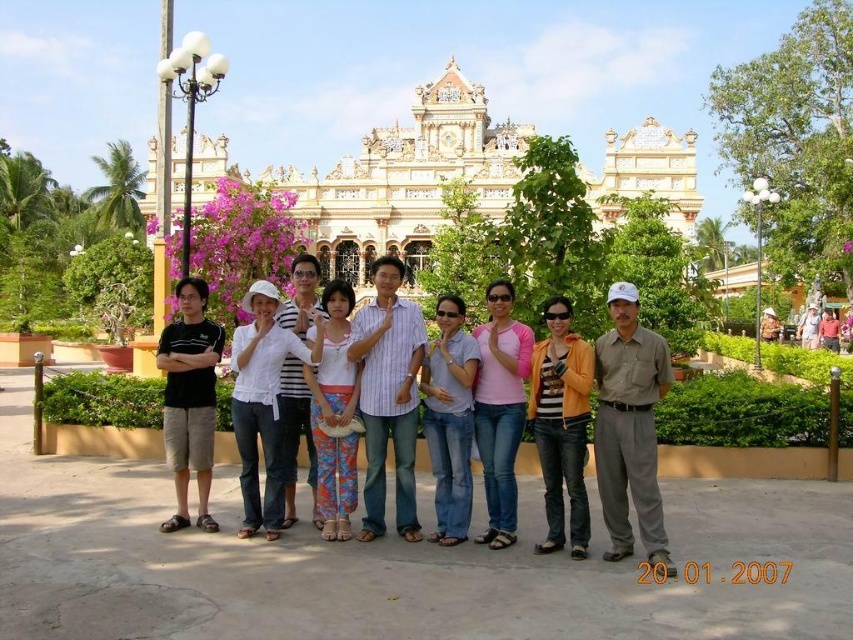
Does orange denim jacket at center have a greater width compared to pink cotton shirt at center?

Correct, the width of orange denim jacket at center exceeds that of pink cotton shirt at center.

Locate an element on the screen. orange denim jacket at center is located at coordinates (561, 424).

Which is in front, point (548, 330) or point (509, 422)?

Point (509, 422)

Locate an element on the screen. orange denim jacket at center is located at coordinates (x=561, y=424).

Who is lower down, striped cotton shirt at center or white cotton shirt at center?

Positioned lower is white cotton shirt at center.

Which is more to the left, striped cotton shirt at center or white cotton shirt at center?

white cotton shirt at center is more to the left.

Is point (389, 291) farther from viewer compared to point (248, 477)?

Yes, it is behind point (248, 477).

Where is `striped cotton shirt at center`? The height and width of the screenshot is (640, 853). striped cotton shirt at center is located at coordinates (387, 396).

Can you confirm if brown cotton shirt at center is taller than orange denim jacket at center?

Correct, brown cotton shirt at center is much taller as orange denim jacket at center.

Who is higher up, brown cotton shirt at center or orange denim jacket at center?

Positioned higher is orange denim jacket at center.

Does point (633, 342) lie in front of point (582, 534)?

No, (633, 342) is further to viewer.

Where is `brown cotton shirt at center`? The height and width of the screenshot is (640, 853). brown cotton shirt at center is located at coordinates (x=630, y=428).